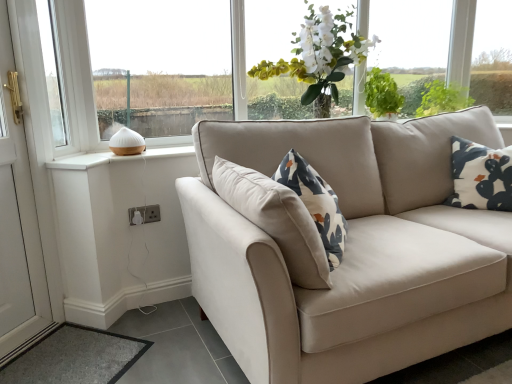
Question: From a real-world perspective, relative to white ceramic diffuser at left, acting as the 1th window starting from the right, is gray carpet at lower left vertically above or below?

Choices:
 (A) above
 (B) below

Answer: (B)

Question: Is point (56, 367) closer or farther from the camera than point (195, 99)?

Choices:
 (A) farther
 (B) closer

Answer: (B)

Question: Estimate the real-world distances between objects in this image. Which object is farther from the white glossy door at left?

Choices:
 (A) white plastic socket at lower left
 (B) white cotton pillow at upper right
 (C) white ceramic diffuser at left, acting as the 1th window starting from the right
 (D) white silk flowers at upper center
 (E) white plastic window at upper left, arranged as the second window when viewed from the right

Answer: (B)

Question: Which object is the closest to the white cotton pillow at upper right?

Choices:
 (A) white ceramic diffuser at left, the second window positioned from the left
 (B) white plastic window at upper left, which is the first window in left-to-right order
 (C) white plastic socket at lower left
 (D) white silk flowers at upper center
 (E) green leafy plant at upper right

Answer: (E)